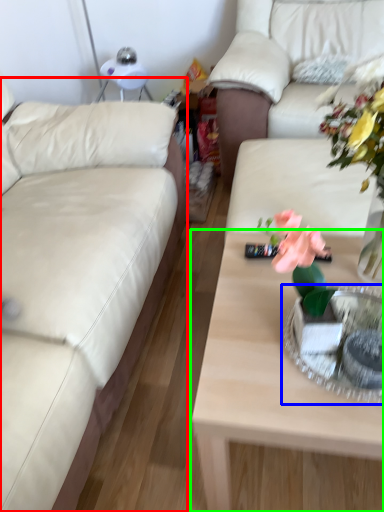
Question: Estimate the real-world distances between objects in this image. Which object is closer to studio couch (highlighted by a red box), tableware (highlighted by a blue box) or coffee table (highlighted by a green box)?

Choices:
 (A) tableware
 (B) coffee table

Answer: (B)